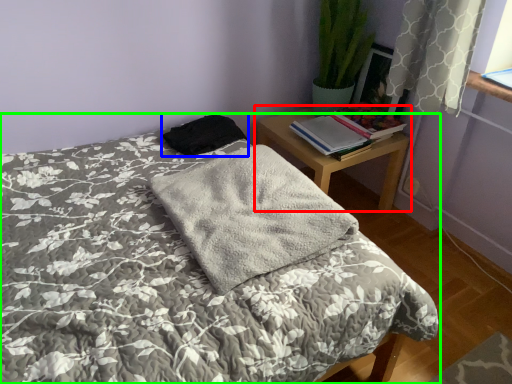
Question: Which object is positioned farthest from nightstand (highlighted by a red box)? Select from material (highlighted by a blue box) and bed (highlighted by a green box).

Choices:
 (A) material
 (B) bed

Answer: (B)